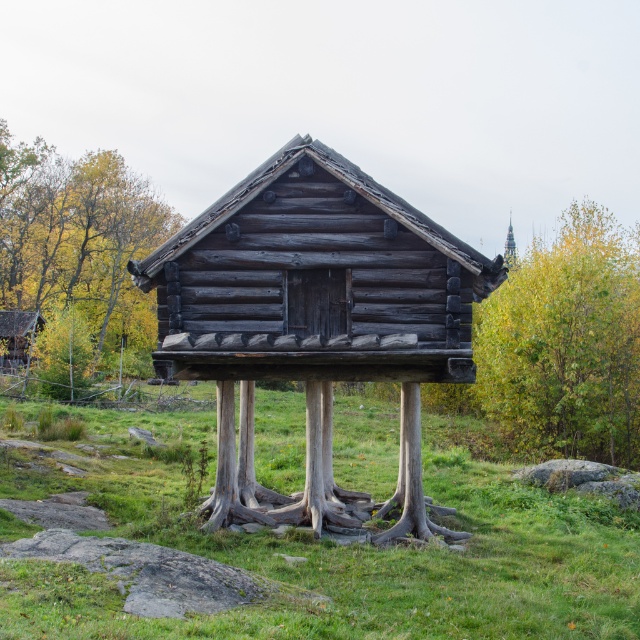
You are standing in the grassy area and looking at the brown wood tree at left and the wooden cabin at center. Which object is closer to you?

The brown wood tree at left is closer to you because it is positioned over the wooden cabin at center, indicating it is in front of the cabin.

You are planning to build a new fence around the wooden cabin at center. Considering the size of the brown wood tree at left, will it be possible to place the fence close to the tree without cutting it down?

The brown wood tree at left is larger in size compared to the wooden cabin at center. Since the tree is bigger, it may occupy more space, so placing the fence close to it without cutting it down might be challenging depending on the tree canopy and roots. However, the exact feasibility would depend on the specific dimensions of the tree and the desired fence placement.

You are standing in front of the rustic wooden structure. You see the green leafy tree at right and the brown wood tree at left. Which tree is positioned more to the east?

The green leafy tree at right is positioned more to the east because it is to the right of the brown wood tree at left.